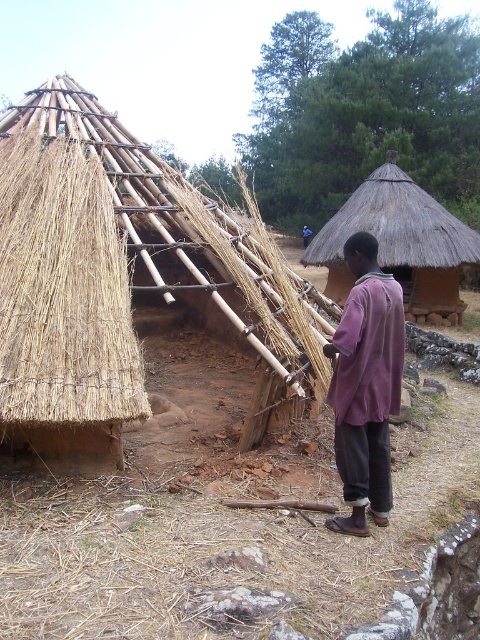
Question: Which object is farther from the camera taking this photo?

Choices:
 (A) thatched straw roof at upper right
 (B) brown thatch hut at left
 (C) natural straw thatch at upper left
 (D) purple cotton shirt at center

Answer: (A)

Question: Considering the relative positions of natural straw thatch at upper left and thatched straw roof at upper right in the image provided, where is natural straw thatch at upper left located with respect to thatched straw roof at upper right?

Choices:
 (A) below
 (B) above

Answer: (A)

Question: Is brown thatch hut at left below thatched straw roof at upper right?

Choices:
 (A) yes
 (B) no

Answer: (A)

Question: Which object appears farthest from the camera in this image?

Choices:
 (A) thatched straw roof at upper right
 (B) purple cotton shirt at center
 (C) brown thatch hut at left
 (D) natural straw thatch at upper left

Answer: (A)

Question: Which of the following is the farthest from the observer?

Choices:
 (A) (84, 380)
 (B) (389, 256)

Answer: (B)

Question: Does natural straw thatch at upper left appear on the right side of purple cotton shirt at center?

Choices:
 (A) yes
 (B) no

Answer: (B)